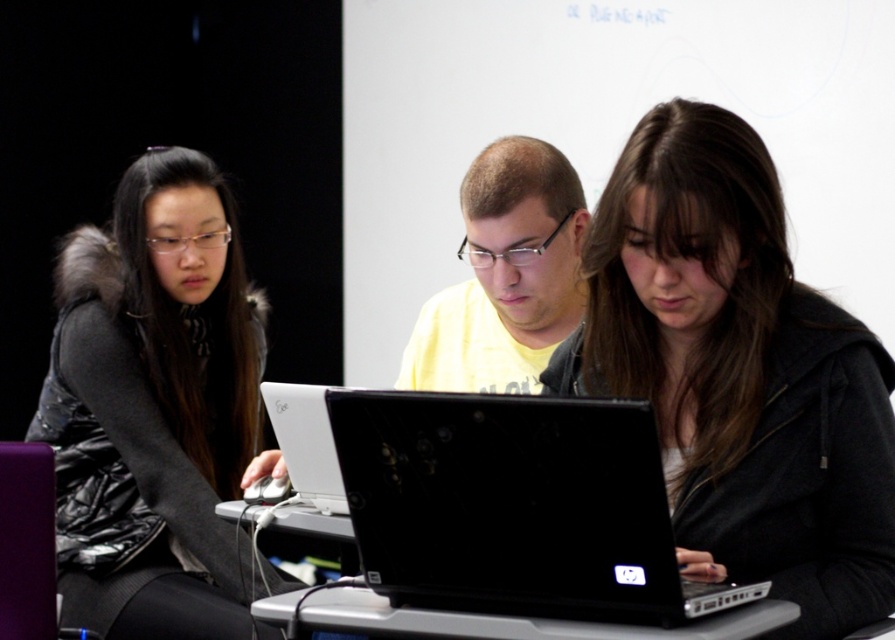
Is matte black hoodie at center bigger than white glossy laptop at center?

Indeed, matte black hoodie at center has a larger size compared to white glossy laptop at center.

Is matte black hoodie at center further to the viewer compared to white glossy laptop at center?

No, matte black hoodie at center is in front of white glossy laptop at center.

You are a GUI agent. You are given a task and a screenshot of the screen. Output one action in this format:
    pyautogui.click(x=<x>, y=<y>)
    Task: Click on the matte black hoodie at center
    The image size is (895, 640).
    Given the screenshot: What is the action you would take?
    pyautogui.click(x=738, y=372)

The image size is (895, 640). What do you see at coordinates (155, 410) in the screenshot?
I see `matte black jacket at left` at bounding box center [155, 410].

Who is positioned more to the right, matte black jacket at left or matte yellow shirt at center?

Positioned to the right is matte yellow shirt at center.

I want to click on matte black jacket at left, so click(x=155, y=410).

Does matte yellow shirt at center lie behind yellow matte shirt at center?

Yes, it is behind yellow matte shirt at center.

Which is in front, point (495, 310) or point (420, 344)?

Point (495, 310) is in front.

Describe the element at coordinates (505, 275) in the screenshot. I see `matte yellow shirt at center` at that location.

Find the location of `matte yellow shirt at center`. matte yellow shirt at center is located at coordinates (505, 275).